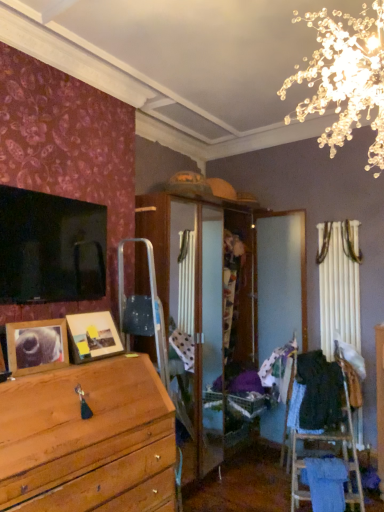
Question: Is wooden picture frame at lower left, arranged as the second picture frame when viewed from the back, not near black fabric at right, which appears as the second clothing when viewed from the left?

Choices:
 (A) yes
 (B) no

Answer: (A)

Question: Is black fabric at right, the first clothing when ordered from right to left, at the back of wooden picture frame at lower left, arranged as the second picture frame when viewed from the back?

Choices:
 (A) no
 (B) yes

Answer: (A)

Question: Is wooden picture frame at lower left, arranged as the second picture frame when viewed from the back, next to black fabric at right, the first clothing when ordered from right to left?

Choices:
 (A) yes
 (B) no

Answer: (B)

Question: Is wooden picture frame at lower left, arranged as the second picture frame when viewed from the back, to the right of black fabric at right, the first clothing when ordered from right to left, from the viewer's perspective?

Choices:
 (A) yes
 (B) no

Answer: (B)

Question: Is black fabric at right, which appears as the second clothing when viewed from the left, located within wooden picture frame at lower left, arranged as the second picture frame when viewed from the back?

Choices:
 (A) yes
 (B) no

Answer: (B)

Question: Does wooden picture frame at lower left, the 1th picture frame viewed from the front, appear on the left side of black fabric at right, the first clothing when ordered from right to left?

Choices:
 (A) yes
 (B) no

Answer: (A)

Question: Can you confirm if patterned fabric at center, which is the 2th clothing in right-to-left order, is shorter than black fabric at right, the first clothing when ordered from right to left?

Choices:
 (A) no
 (B) yes

Answer: (B)

Question: Can you confirm if patterned fabric at center, positioned as the first clothing in left-to-right order, is smaller than black fabric at right, which appears as the second clothing when viewed from the left?

Choices:
 (A) no
 (B) yes

Answer: (B)

Question: Is patterned fabric at center, which is the 2th clothing in right-to-left order, positioned beyond the bounds of black fabric at right, the first clothing when ordered from right to left?

Choices:
 (A) no
 (B) yes

Answer: (B)

Question: From the image's perspective, would you say patterned fabric at center, which is the 2th clothing in right-to-left order, is positioned over black fabric at right, the first clothing when ordered from right to left?

Choices:
 (A) no
 (B) yes

Answer: (B)

Question: Is the depth of patterned fabric at center, positioned as the first clothing in left-to-right order, less than that of black fabric at right, which appears as the second clothing when viewed from the left?

Choices:
 (A) no
 (B) yes

Answer: (A)

Question: From a real-world perspective, is patterned fabric at center, positioned as the first clothing in left-to-right order, over black fabric at right, which appears as the second clothing when viewed from the left?

Choices:
 (A) yes
 (B) no

Answer: (A)

Question: Is patterned fabric at center, which is the 2th clothing in right-to-left order, positioned in front of wooden picture frame at lower left, arranged as the second picture frame when viewed from the back?

Choices:
 (A) no
 (B) yes

Answer: (A)